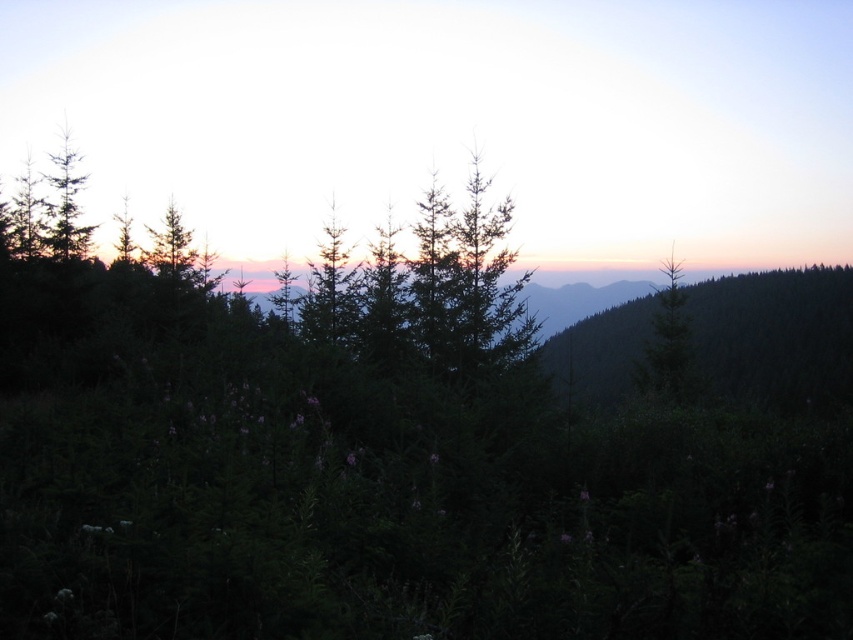
Which of these two, silhouetted evergreen trees at upper center or green matte tree at right, stands taller?

With more height is silhouetted evergreen trees at upper center.

Which of these two, silhouetted evergreen trees at upper center or green matte tree at right, stands shorter?

green matte tree at right

Does point (28, 99) come farther from viewer compared to point (657, 362)?

Yes.

Find the location of a particular element. silhouetted evergreen trees at upper center is located at coordinates (453, 120).